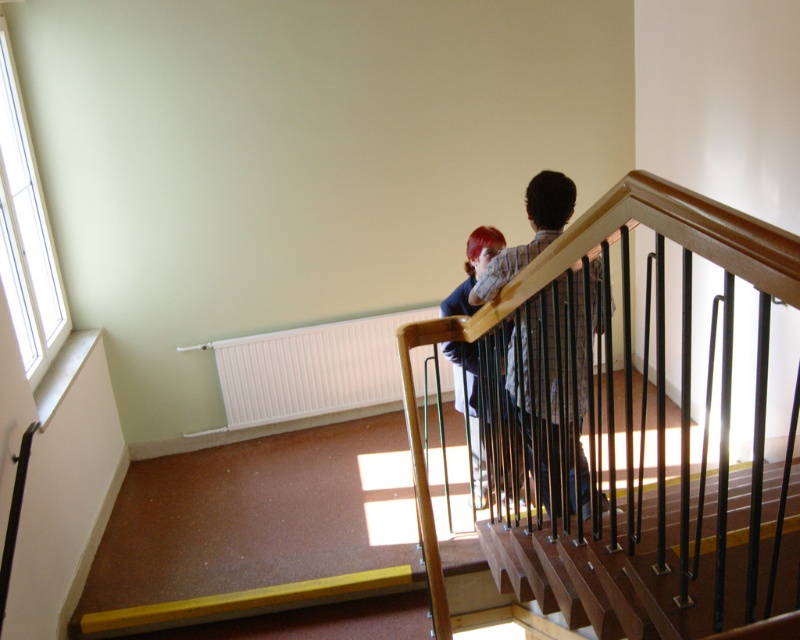
Which is more to the right, wooden at upper center or plaid shirt at upper center?

From the viewer's perspective, wooden at upper center appears more on the right side.

Which is more to the left, wooden at upper center or plaid shirt at upper center?

Positioned to the left is plaid shirt at upper center.

Which is behind, point (704, 618) or point (560, 186)?

The point (560, 186) is more distant.

Image resolution: width=800 pixels, height=640 pixels. Find the location of `wooden at upper center`. wooden at upper center is located at coordinates (605, 579).

Is wooden handrail at upper center below plaid shirt at center?

Correct, wooden handrail at upper center is located below plaid shirt at center.

Image resolution: width=800 pixels, height=640 pixels. What do you see at coordinates (621, 292) in the screenshot?
I see `wooden handrail at upper center` at bounding box center [621, 292].

Does point (746, 243) lie behind point (478, 275)?

No, it is in front of (478, 275).

Locate an element on the screen. The image size is (800, 640). wooden handrail at upper center is located at coordinates (621, 292).

Who is higher up, wooden at upper center or plaid shirt at center?

plaid shirt at center is higher up.

Is wooden at upper center taller than plaid shirt at center?

Incorrect, wooden at upper center's height is not larger of plaid shirt at center's.

Image resolution: width=800 pixels, height=640 pixels. What do you see at coordinates (605, 579) in the screenshot?
I see `wooden at upper center` at bounding box center [605, 579].

Locate an element on the screen. Image resolution: width=800 pixels, height=640 pixels. wooden at upper center is located at coordinates (605, 579).